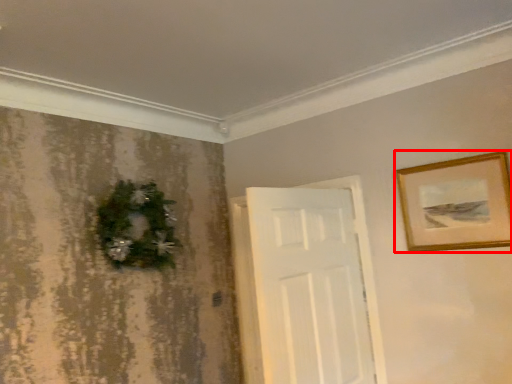
Question: Where is picture frame (annotated by the red box) located in relation to christmas decoration in the image?

Choices:
 (A) left
 (B) right

Answer: (B)